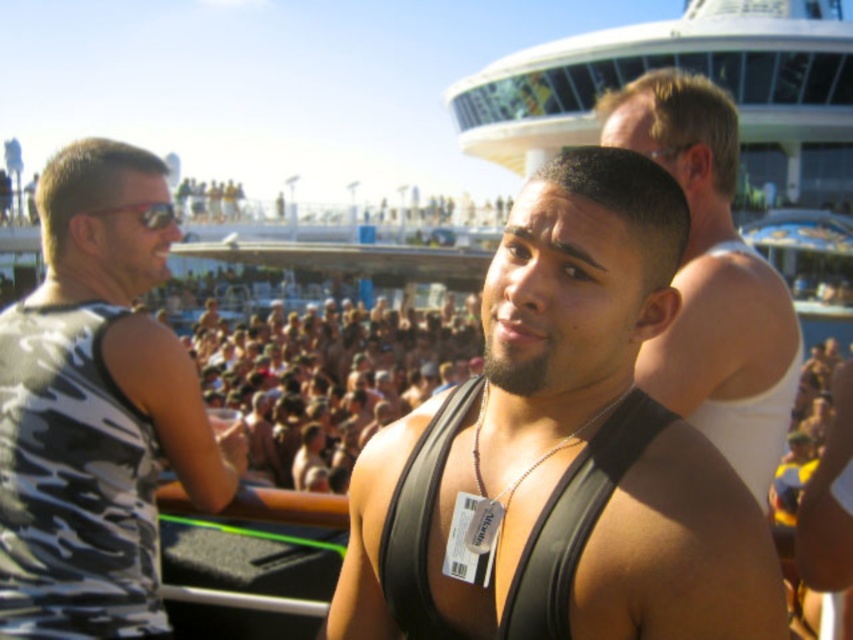
You are a photographer standing on the cruise ship deck. You want to take a photo that includes both the black fabric tank top at right and the black leather vest at center. Given that your camera has a maximum zoom range of 10 meters, will you be able to capture both subjects in a single frame without moving?

The distance between the black fabric tank top at right and the black leather vest at center is 14.90 meters. Since your camera can only zoom up to 10 meters, you won not be able to capture both subjects in a single frame without moving.

You are a photographer on the cruise ship deck. You need to take a photo that includes both the black matte vest at center and the camouflage tank top at left. Based on their positions, which one should you adjust your camera angle to focus on first to ensure both are in frame?

You should focus on the camouflage tank top at left first because the black matte vest at center is to the right of it, so adjusting your angle to start with the leftmost object ensures both are captured in the frame.

You are standing on the cruise ship deck and want to take a photo of both the point at coordinate (189,467) and the point at coordinate (788,388). Since you can only focus on one point at a time, which point should you focus on first to ensure the other point remains in the background?

You should focus on point (189,467) first because it is closer to you than point (788,388). By focusing on the closer point, the farther point will naturally be in the background of your photo.